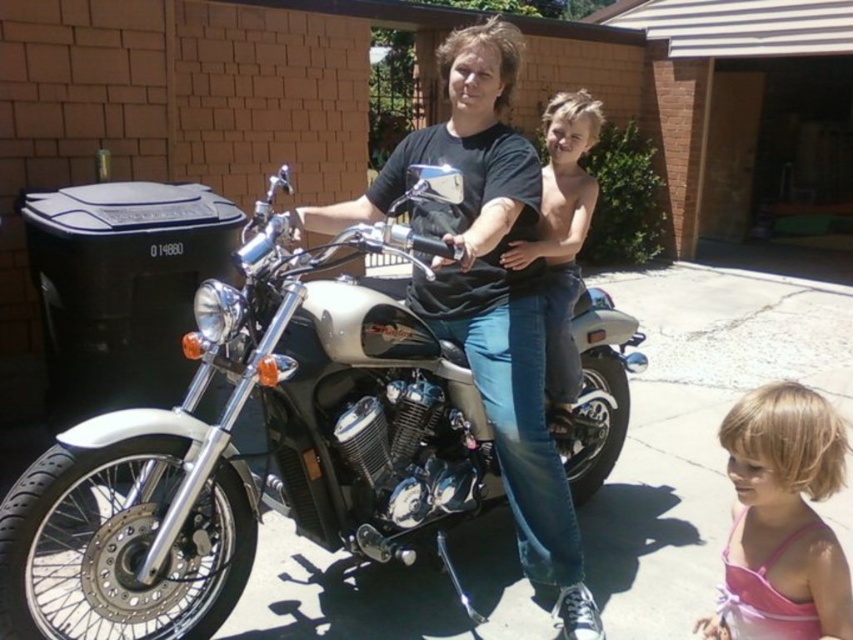
Question: Is white metallic motorcycle at center closer to the viewer compared to pink fabric dress at lower right?

Choices:
 (A) no
 (B) yes

Answer: (A)

Question: Which object is farther from the camera taking this photo?

Choices:
 (A) white metallic motorcycle at center
 (B) pink fabric dress at lower right

Answer: (A)

Question: Is white metallic motorcycle at center above black matte shirt at center?

Choices:
 (A) yes
 (B) no

Answer: (B)

Question: Which object is the closest to the white metallic motorcycle at center?

Choices:
 (A) shiny blonde hair at center
 (B) black matte shirt at center

Answer: (B)

Question: Considering the real-world distances, which object is closest to the black matte shirt at center?

Choices:
 (A) shiny blonde hair at center
 (B) pink fabric dress at lower right
 (C) white metallic motorcycle at center

Answer: (A)

Question: Does pink fabric dress at lower right appear over shiny blonde hair at center?

Choices:
 (A) yes
 (B) no

Answer: (B)